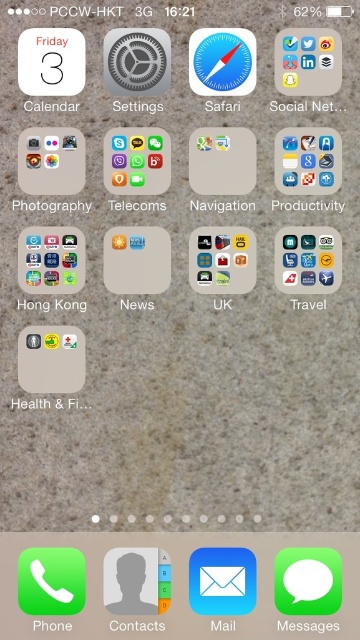
Can you confirm if black matte social net at upper right is positioned to the right of green matte messages at bottom right?

Yes, black matte social net at upper right is to the right of green matte messages at bottom right.

Based on the photo, does black matte social net at upper right lie behind green matte messages at bottom right?

Yes, black matte social net at upper right is behind green matte messages at bottom right.

Between point (326, 104) and point (315, 628), which one is positioned behind?

Positioned behind is point (326, 104).

The image size is (360, 640). I want to click on black matte social net at upper right, so click(x=304, y=106).

Who is taller, red glossy navigation at center or green matte messages at bottom right?

red glossy navigation at center is taller.

Measure the distance between red glossy navigation at center and camera.

red glossy navigation at center and camera are 34.31 inches apart.

Is point (251, 202) farther from viewer compared to point (312, 627)?

That is True.

Where is `red glossy navigation at center`? The height and width of the screenshot is (640, 360). red glossy navigation at center is located at coordinates (222, 205).

Does red glossy navigation at center appear on the left side of textured gray settings at center?

Incorrect, red glossy navigation at center is not on the left side of textured gray settings at center.

Which is behind, point (254, 208) or point (151, 112)?

The point (254, 208) is behind.

Is point (244, 211) in front of point (154, 108)?

No, it is behind (154, 108).

This screenshot has height=640, width=360. Find the location of `red glossy navigation at center`. red glossy navigation at center is located at coordinates (222, 205).